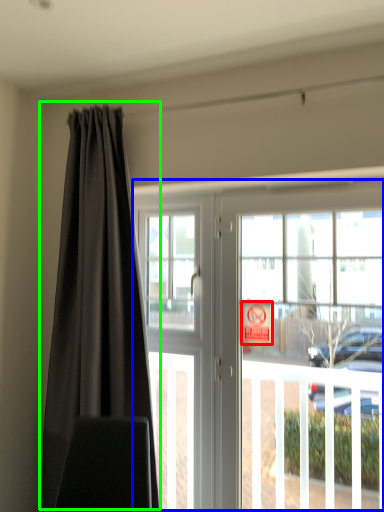
Question: Which object is positioned closest to parking sign (highlighted by a red box)? Select from door (highlighted by a blue box) and curtain (highlighted by a green box).

Choices:
 (A) door
 (B) curtain

Answer: (A)